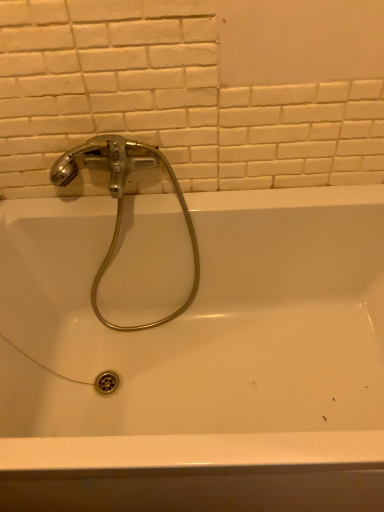
Find the location of a particular element. This screenshot has height=512, width=384. white glossy bathtub at upper center is located at coordinates (194, 352).

The image size is (384, 512). In order to click on white glossy bathtub at upper center in this screenshot , I will do `click(194, 352)`.

Does white matte ceramic tile at upper center have a lesser height compared to white glossy bathtub at upper center?

Result: Correct, white matte ceramic tile at upper center is not as tall as white glossy bathtub at upper center.

Is white matte ceramic tile at upper center facing away from white glossy bathtub at upper center?

white matte ceramic tile at upper center does not have its back to white glossy bathtub at upper center.

Considering the positions of objects white matte ceramic tile at upper center and white glossy bathtub at upper center in the image provided, who is in front, white matte ceramic tile at upper center or white glossy bathtub at upper center?

white glossy bathtub at upper center is more forward.

Are white matte ceramic tile at upper center and white glossy bathtub at upper center beside each other?

No, white matte ceramic tile at upper center is not touching white glossy bathtub at upper center.

Which is correct: white matte ceramic tile at upper center is inside polished chrome faucet at upper left, or outside of it?

white matte ceramic tile at upper center cannot be found inside polished chrome faucet at upper left.

From the image's perspective, is white matte ceramic tile at upper center located above or below polished chrome faucet at upper left?

Clearly, from the image's perspective, white matte ceramic tile at upper center is above polished chrome faucet at upper left.

Is white matte ceramic tile at upper center oriented away from polished chrome faucet at upper left?

No, polished chrome faucet at upper left is not at the back of white matte ceramic tile at upper center.

Based on the photo, from a real-world perspective, between white matte ceramic tile at upper center and polished chrome faucet at upper left, who is vertically higher?

From a 3D spatial view, white matte ceramic tile at upper center is above.

In the scene shown: Can we say white glossy bathtub at upper center lies outside white matte ceramic tile at upper center?

Yes, white glossy bathtub at upper center is located beyond the bounds of white matte ceramic tile at upper center.

Is white glossy bathtub at upper center next to white matte ceramic tile at upper center?

white glossy bathtub at upper center and white matte ceramic tile at upper center are clearly separated.

Based on their sizes in the image, would you say white glossy bathtub at upper center is bigger or smaller than white matte ceramic tile at upper center?

white glossy bathtub at upper center is bigger than white matte ceramic tile at upper center.

Consider the image. Considering the relative sizes of white glossy bathtub at upper center and white matte ceramic tile at upper center in the image provided, is white glossy bathtub at upper center taller than white matte ceramic tile at upper center?

Correct, white glossy bathtub at upper center is much taller as white matte ceramic tile at upper center.

From a real-world perspective, is polished chrome faucet at upper left located higher than white matte ceramic tile at upper center?

No, from a real-world perspective, polished chrome faucet at upper left is not on top of white matte ceramic tile at upper center.

Does polished chrome faucet at upper left have a lesser width compared to white matte ceramic tile at upper center?

Incorrect, the width of polished chrome faucet at upper left is not less than that of white matte ceramic tile at upper center.

Can you tell me how much polished chrome faucet at upper left and white matte ceramic tile at upper center differ in facing direction?

There is a 1.03-degree angle between the facing directions of polished chrome faucet at upper left and white matte ceramic tile at upper center.

Find the location of a particular element. The width and height of the screenshot is (384, 512). ceramic tile above the polished chrome faucet at upper left (from the image's perspective) is located at coordinates (194, 90).

Is polished chrome faucet at upper left taller or shorter than white glossy bathtub at upper center?

In the image, polished chrome faucet at upper left appears to be taller than white glossy bathtub at upper center.

How different are the orientations of polished chrome faucet at upper left and white glossy bathtub at upper center in degrees?

The angular difference between polished chrome faucet at upper left and white glossy bathtub at upper center is 0.000412 degrees.

Does point (154, 322) lie behind point (369, 408)?

Yes, point (154, 322) is behind point (369, 408).

Identify the location of bathtub on the right of polished chrome faucet at upper left. (194, 352).

Considering the sizes of objects white glossy bathtub at upper center and polished chrome faucet at upper left in the image provided, who is shorter, white glossy bathtub at upper center or polished chrome faucet at upper left?

Standing shorter between the two is white glossy bathtub at upper center.

Where is `bathtub lying below the polished chrome faucet at upper left (from the image's perspective)`? bathtub lying below the polished chrome faucet at upper left (from the image's perspective) is located at coordinates (194, 352).

Are white glossy bathtub at upper center and polished chrome faucet at upper left beside each other?

No, white glossy bathtub at upper center is not making contact with polished chrome faucet at upper left.

Identify the location of ceramic tile that appears above the white glossy bathtub at upper center (from the image's perspective). The image size is (384, 512). (194, 90).

The image size is (384, 512). In order to click on ceramic tile above the polished chrome faucet at upper left (from a real-world perspective) in this screenshot , I will do `click(194, 90)`.

From the image, which object appears to be farther from polished chrome faucet at upper left, white matte ceramic tile at upper center or white glossy bathtub at upper center?

white glossy bathtub at upper center.

When comparing their distances from polished chrome faucet at upper left, does white glossy bathtub at upper center or white matte ceramic tile at upper center seem closer?

Among the two, white matte ceramic tile at upper center is located nearer to polished chrome faucet at upper left.

Looking at the image, which one is located further to white glossy bathtub at upper center, white matte ceramic tile at upper center or polished chrome faucet at upper left?

white matte ceramic tile at upper center is further to white glossy bathtub at upper center.

Estimate the real-world distances between objects in this image. Which object is further from white matte ceramic tile at upper center, polished chrome faucet at upper left or white glossy bathtub at upper center?

white glossy bathtub at upper center is further to white matte ceramic tile at upper center.

When comparing their distances from white matte ceramic tile at upper center, does white glossy bathtub at upper center or polished chrome faucet at upper left seem further?

Among the two, white glossy bathtub at upper center is located further to white matte ceramic tile at upper center.

From the image, which object appears to be farther from white glossy bathtub at upper center, polished chrome faucet at upper left or white matte ceramic tile at upper center?

white matte ceramic tile at upper center is further to white glossy bathtub at upper center.

Identify the location of tap between white matte ceramic tile at upper center and white glossy bathtub at upper center in the up-down direction. click(x=123, y=200).